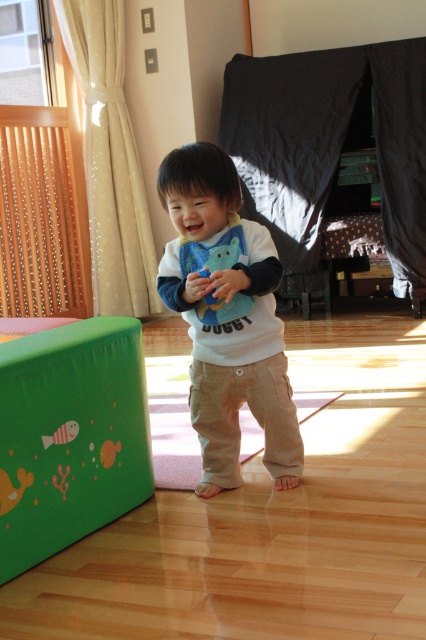
Who is shorter, green rubber play cube at lower left or matte white shirt at center?

Standing shorter between the two is green rubber play cube at lower left.

In the scene shown: Who is positioned more to the left, green rubber play cube at lower left or matte white shirt at center?

From the viewer's perspective, green rubber play cube at lower left appears more on the left side.

What do you see at coordinates (69, 436) in the screenshot?
I see `green rubber play cube at lower left` at bounding box center [69, 436].

At what (x,y) coordinates should I click in order to perform the action: click on green rubber play cube at lower left. Please return your answer as a coordinate pair (x, y). Looking at the image, I should click on (69, 436).